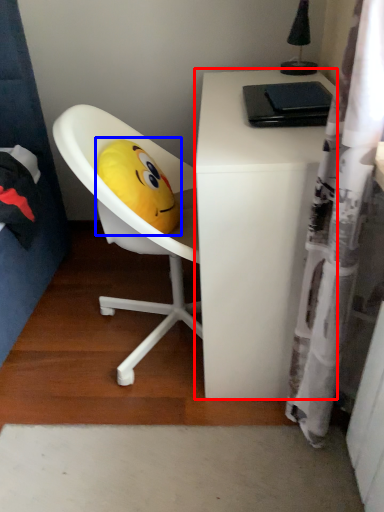
Question: Which object appears closest to the camera in this image, desk (highlighted by a red box) or toy (highlighted by a blue box)?

Choices:
 (A) desk
 (B) toy

Answer: (A)